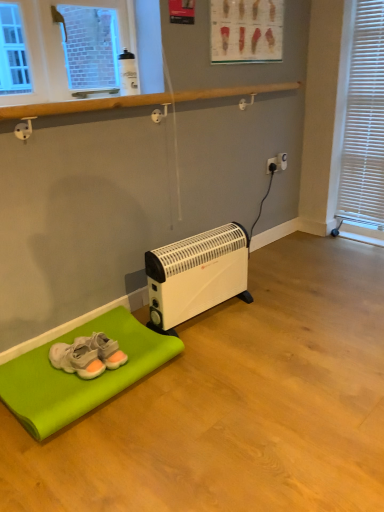
Image resolution: width=384 pixels, height=512 pixels. Describe the element at coordinates (88, 355) in the screenshot. I see `gray suede sneakers at lower left` at that location.

I want to click on white plastic electric outlet at center-right, placed as the second electric outlet when sorted from left to right, so click(x=281, y=161).

Is point (90, 338) farther from camera compared to point (193, 309)?

No, it is in front of (193, 309).

The width and height of the screenshot is (384, 512). Identify the location of heater behind the gray suede sneakers at lower left. (197, 274).

Considering the relative sizes of gray suede sneakers at lower left and white plastic heater at lower center in the image provided, is gray suede sneakers at lower left smaller than white plastic heater at lower center?

Yes.

Which object is positioned more to the right, gray suede sneakers at lower left or white plastic heater at lower center?

From the viewer's perspective, white plastic heater at lower center appears more on the right side.

Can you confirm if white plastic electric outlet at upper right, marked as the second electric outlet in a right-to-left arrangement, is shorter than green fabric mat at lower left?

No, white plastic electric outlet at upper right, marked as the second electric outlet in a right-to-left arrangement, is not shorter than green fabric mat at lower left.

Which of these two, white plastic electric outlet at upper right, arranged as the first electric outlet when viewed from the left, or green fabric mat at lower left, is wider?

With larger width is green fabric mat at lower left.

Does white plastic electric outlet at upper right, arranged as the first electric outlet when viewed from the left, appear on the left side of green fabric mat at lower left?

No, white plastic electric outlet at upper right, arranged as the first electric outlet when viewed from the left, is not to the left of green fabric mat at lower left.

Which is nearer, (267, 162) or (45, 414)?

Point (267, 162) appears to be farther away from the viewer than point (45, 414).

Based on the photo, is green fabric mat at lower left inside the boundaries of white plastic electric outlet at center-right, which is the 1th electric outlet from right to left, or outside?

green fabric mat at lower left is not enclosed by white plastic electric outlet at center-right, which is the 1th electric outlet from right to left.

Which object is thinner, green fabric mat at lower left or white plastic electric outlet at center-right, placed as the second electric outlet when sorted from left to right?

With smaller width is white plastic electric outlet at center-right, placed as the second electric outlet when sorted from left to right.

From a real-world perspective, is green fabric mat at lower left physically above white plastic electric outlet at center-right, placed as the second electric outlet when sorted from left to right?

Incorrect, from a real-world perspective, green fabric mat at lower left is lower than white plastic electric outlet at center-right, placed as the second electric outlet when sorted from left to right.

Consider the image. Is green fabric mat at lower left not near white plastic electric outlet at center-right, which is the 1th electric outlet from right to left?

That's right, there is a large distance between green fabric mat at lower left and white plastic electric outlet at center-right, which is the 1th electric outlet from right to left.

Based on the photo, who is more distant, white plastic blinds at right or gray suede sneakers at lower left?

white plastic blinds at right is more distant.

Can you see white plastic blinds at right touching gray suede sneakers at lower left?

They are not placed beside each other.

Is point (370, 219) closer or farther from the camera than point (105, 343)?

Point (370, 219).

Which of these two, green fabric mat at lower left or gray suede sneakers at lower left, is bigger?

With larger size is green fabric mat at lower left.

Is green fabric mat at lower left aimed at gray suede sneakers at lower left?

No, green fabric mat at lower left is not facing towards gray suede sneakers at lower left.

Considering the relative sizes of green fabric mat at lower left and gray suede sneakers at lower left in the image provided, is green fabric mat at lower left shorter than gray suede sneakers at lower left?

Yes.

Considering the sizes of objects green fabric mat at lower left and gray suede sneakers at lower left in the image provided, who is wider, green fabric mat at lower left or gray suede sneakers at lower left?

green fabric mat at lower left is wider.

Is white plastic electric outlet at center-right, placed as the second electric outlet when sorted from left to right, wider than white plastic heater at lower center?

No.

Considering the positions of objects white plastic electric outlet at center-right, placed as the second electric outlet when sorted from left to right, and white plastic heater at lower center in the image provided, who is more to the right, white plastic electric outlet at center-right, placed as the second electric outlet when sorted from left to right, or white plastic heater at lower center?

white plastic electric outlet at center-right, placed as the second electric outlet when sorted from left to right.

Is white plastic heater at lower center located within white plastic electric outlet at center-right, which is the 1th electric outlet from right to left?

No, white plastic heater at lower center is not a part of white plastic electric outlet at center-right, which is the 1th electric outlet from right to left.

From the picture: Between white plastic electric outlet at center-right, which is the 1th electric outlet from right to left, and white plastic heater at lower center, which one is positioned behind?

white plastic electric outlet at center-right, which is the 1th electric outlet from right to left, is further away from the camera.

Does point (281, 162) come in front of point (88, 340)?

No, it is behind (88, 340).

Would you consider white plastic electric outlet at center-right, which is the 1th electric outlet from right to left, to be distant from gray suede sneakers at lower left?

Yes, white plastic electric outlet at center-right, which is the 1th electric outlet from right to left, is far from gray suede sneakers at lower left.

Looking at this image, which of these two, white plastic electric outlet at center-right, placed as the second electric outlet when sorted from left to right, or gray suede sneakers at lower left, is smaller?

With smaller size is white plastic electric outlet at center-right, placed as the second electric outlet when sorted from left to right.

The image size is (384, 512). Find the location of `footwear located on the left of white plastic heater at lower center`. footwear located on the left of white plastic heater at lower center is located at coordinates (88, 355).

Image resolution: width=384 pixels, height=512 pixels. I want to click on the 1st electric outlet behind the green fabric mat at lower left, starting your count from the anchor, so click(272, 165).

Which object lies nearer to the anchor point white plastic electric outlet at upper right, marked as the second electric outlet in a right-to-left arrangement, white plastic electric outlet at center-right, placed as the second electric outlet when sorted from left to right, or white plastic heater at lower center?

white plastic electric outlet at center-right, placed as the second electric outlet when sorted from left to right.

Based on their spatial positions, is gray suede sneakers at lower left or white plastic electric outlet at center-right, placed as the second electric outlet when sorted from left to right, further from white plastic blinds at right?

gray suede sneakers at lower left.

When comparing their distances from gray suede sneakers at lower left, does white plastic heater at lower center or white plastic blinds at right seem further?

white plastic blinds at right lies further to gray suede sneakers at lower left than the other object.

Estimate the real-world distances between objects in this image. Which object is further from white plastic blinds at right, white plastic electric outlet at upper right, arranged as the first electric outlet when viewed from the left, or white plastic heater at lower center?

The object further to white plastic blinds at right is white plastic heater at lower center.

Looking at this image, estimate the real-world distances between objects in this image. Which object is closer to white plastic electric outlet at center-right, placed as the second electric outlet when sorted from left to right, gray suede sneakers at lower left or green fabric mat at lower left?

Among the two, gray suede sneakers at lower left is located nearer to white plastic electric outlet at center-right, placed as the second electric outlet when sorted from left to right.

Looking at the image, which one is located further to white plastic heater at lower center, green fabric mat at lower left or white plastic blinds at right?

white plastic blinds at right is further to white plastic heater at lower center.

From the image, which object appears to be farther from white plastic blinds at right, gray suede sneakers at lower left or white plastic heater at lower center?

Among the two, gray suede sneakers at lower left is located further to white plastic blinds at right.

Looking at the image, which one is located closer to gray suede sneakers at lower left, green fabric mat at lower left or white plastic electric outlet at upper right, marked as the second electric outlet in a right-to-left arrangement?

Based on the image, green fabric mat at lower left appears to be nearer to gray suede sneakers at lower left.

At what (x,y) coordinates should I click in order to perform the action: click on electric outlet between green fabric mat at lower left and white plastic electric outlet at center-right, placed as the second electric outlet when sorted from left to right, in the front-back direction. Please return your answer as a coordinate pair (x, y). This screenshot has height=512, width=384. Looking at the image, I should click on (272, 165).

In order to click on electric outlet between gray suede sneakers at lower left and white plastic electric outlet at center-right, placed as the second electric outlet when sorted from left to right, along the z-axis in this screenshot , I will do `click(272, 165)`.

Where is `electric outlet located between white plastic electric outlet at upper right, arranged as the first electric outlet when viewed from the left, and white plastic blinds at right in the left-right direction`? electric outlet located between white plastic electric outlet at upper right, arranged as the first electric outlet when viewed from the left, and white plastic blinds at right in the left-right direction is located at coordinates (281, 161).

Image resolution: width=384 pixels, height=512 pixels. Identify the location of electric outlet between white plastic heater at lower center and white plastic electric outlet at center-right, placed as the second electric outlet when sorted from left to right, from front to back. (272, 165).